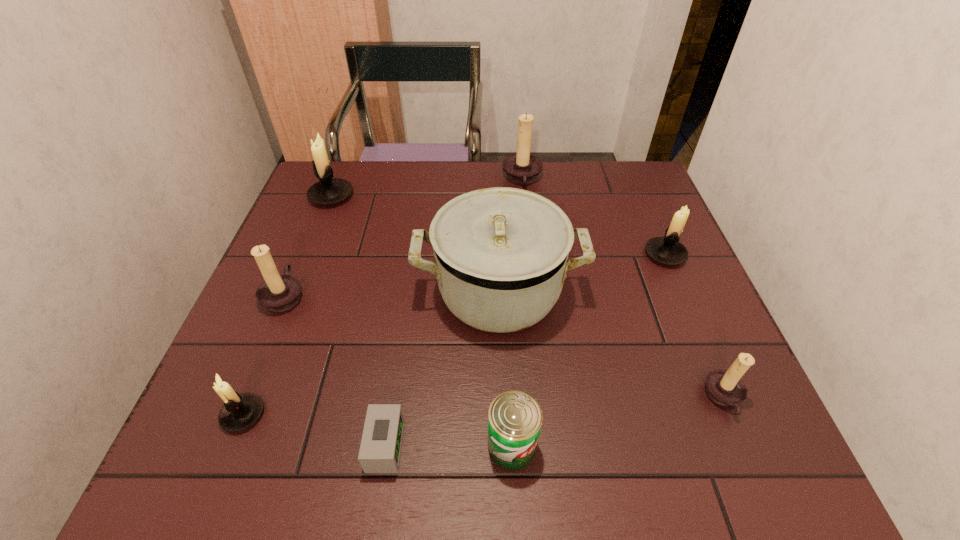
Image resolution: width=960 pixels, height=540 pixels. I want to click on the second brown candle holder from left to right, so click(522, 168).

You are a GUI agent. You are given a task and a screenshot of the screen. Output one action in this format:
    pyautogui.click(x=<x>, y=<y>)
    Task: Click on the fourth candle holder from left to right
    
    Given the screenshot: What is the action you would take?
    pyautogui.click(x=522, y=168)

This screenshot has height=540, width=960. Identify the location of the farthest white candle holder. (328, 191).

In order to click on saucepan in this screenshot , I will do `click(500, 253)`.

Identify the location of the second smallest brown candle holder. The image size is (960, 540). (278, 293).

Where is `the fourth farthest candle holder`? Image resolution: width=960 pixels, height=540 pixels. the fourth farthest candle holder is located at coordinates tap(278, 293).

The height and width of the screenshot is (540, 960). What are the coordinates of `the second farthest white candle holder` in the screenshot? It's located at (667, 250).

At what (x,y) coordinates should I click in order to perform the action: click on the third farthest candle holder. Please return your answer as a coordinate pair (x, y). Looking at the image, I should click on (667, 250).

The height and width of the screenshot is (540, 960). Find the location of `the smallest white candle holder`. the smallest white candle holder is located at coordinates (240, 411).

At what (x,y) coordinates should I click in order to perform the action: click on the rightmost brown candle holder. Please return your answer as a coordinate pair (x, y). Looking at the image, I should click on (726, 388).